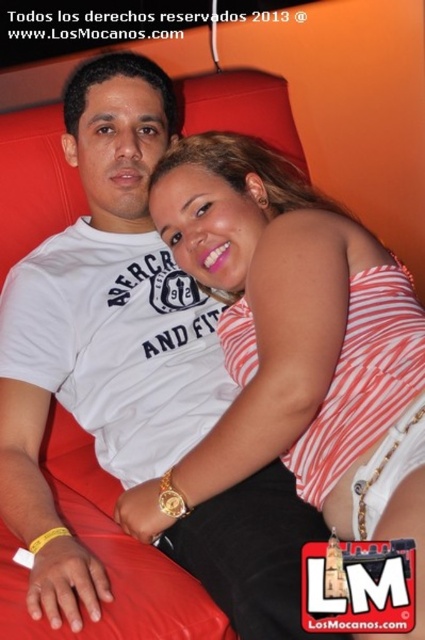
Identify the location of white cotton t-shirt at center. The height and width of the screenshot is (640, 425). (102, 330).

Between point (19, 333) and point (144, 483), which one is positioned in front?

Point (144, 483) is more forward.

Locate an element on the screen. Image resolution: width=425 pixels, height=640 pixels. white cotton t-shirt at center is located at coordinates (102, 330).